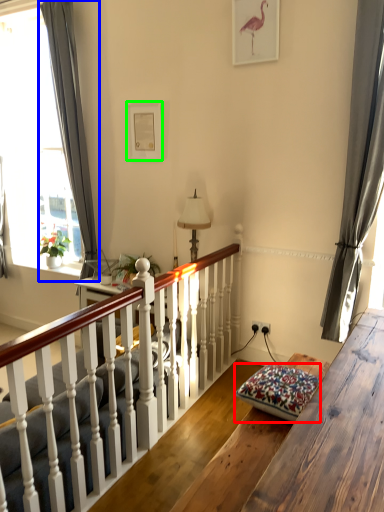
Question: Considering the real-world distances, which object is farthest from pillow (highlighted by a red box)? curtain (highlighted by a blue box) or picture frame (highlighted by a green box)?

Choices:
 (A) curtain
 (B) picture frame

Answer: (A)